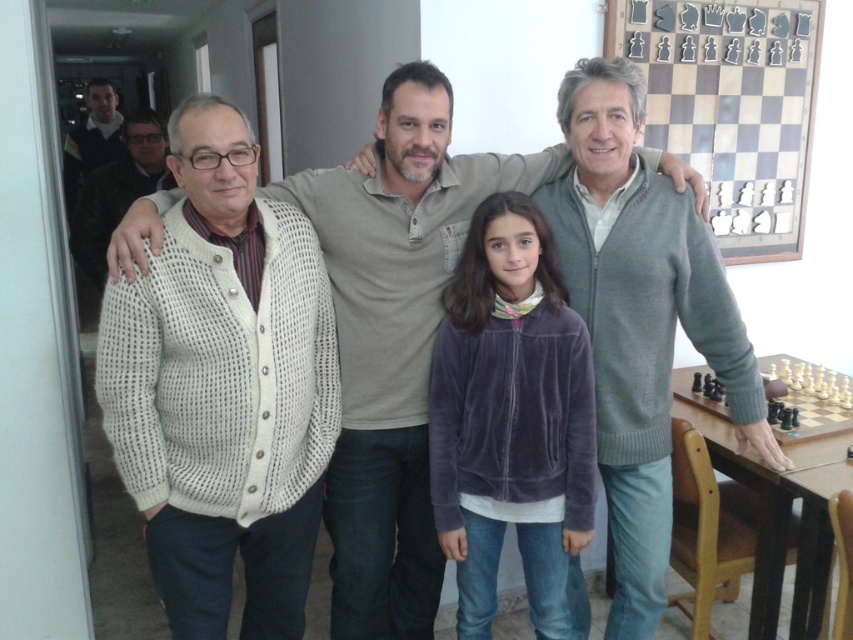
Does gray knit sweater at right appear over white knitted sweater at left?

No.

Which is above, gray knit sweater at right or white knitted sweater at left?

Positioned higher is white knitted sweater at left.

Is point (590, 170) positioned after point (107, 180)?

No, it is not.

What are the coordinates of `gray knit sweater at right` in the screenshot? It's located at (641, 321).

Which is more to the right, white knitted cardigan at left or gray knit sweater at right?

gray knit sweater at right is more to the right.

Which is in front, point (421, 186) or point (647, 460)?

Point (421, 186)

You are a GUI agent. You are given a task and a screenshot of the screen. Output one action in this format:
    pyautogui.click(x=<x>, y=<y>)
    Task: Click on the white knitted cardigan at left
    The height and width of the screenshot is (640, 853).
    Given the screenshot: What is the action you would take?
    pyautogui.click(x=393, y=342)

Is white knitted cardigan at left below white knitted sweater at left?

Yes.

Who is more forward, (x=363, y=410) or (x=146, y=140)?

Positioned in front is point (x=363, y=410).

Locate an element on the screen. The image size is (853, 640). white knitted cardigan at left is located at coordinates (393, 342).